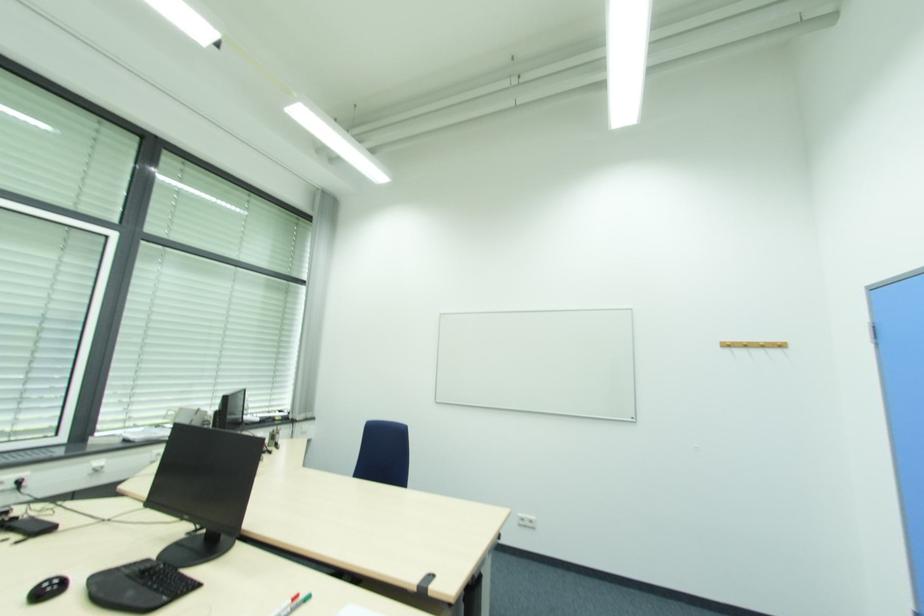
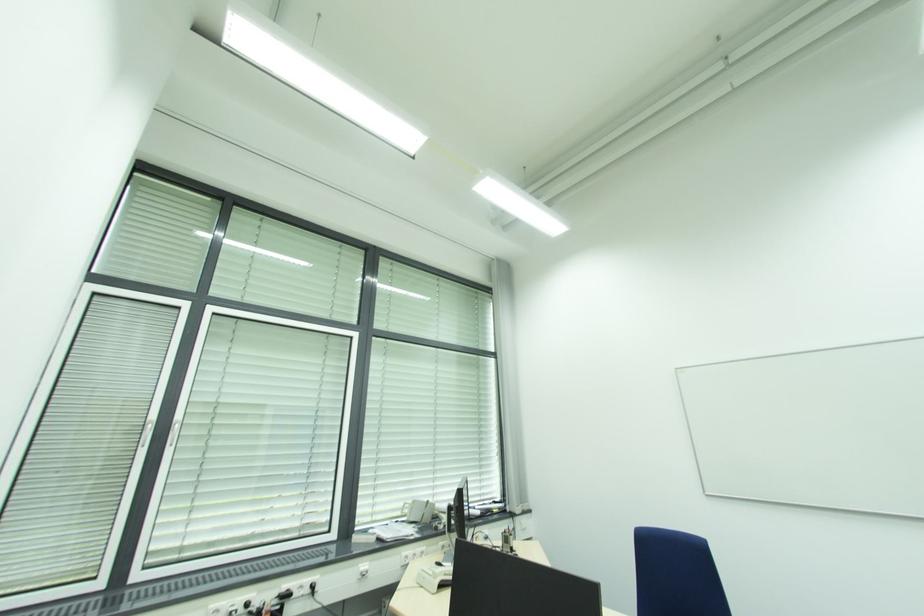
Question: The camera is either moving clockwise (left) or counter-clockwise (right) around the object. The first image is from the beginning of the video and the second image is from the end. Is the camera moving left or right when shooting the video?

Choices:
 (A) Left
 (B) Right

Answer: (B)